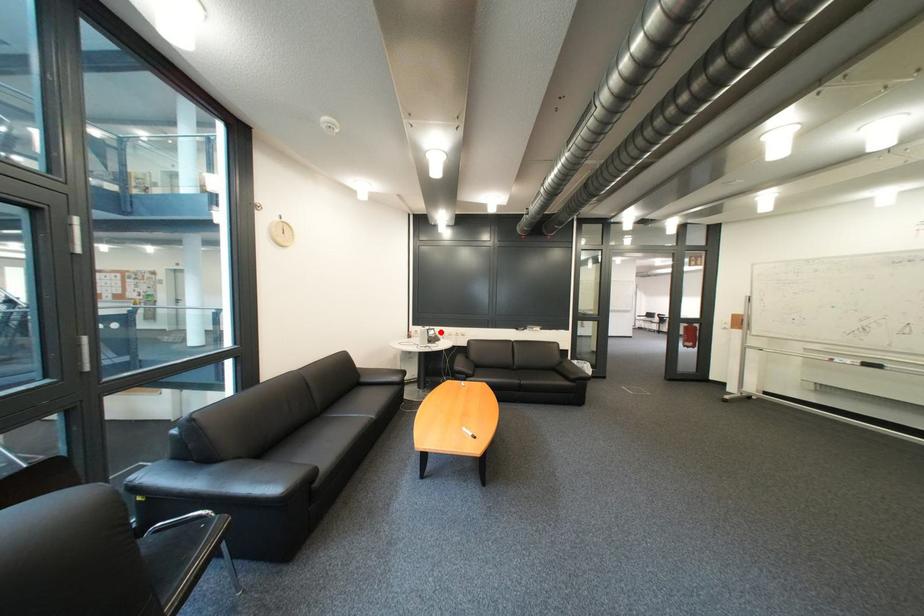
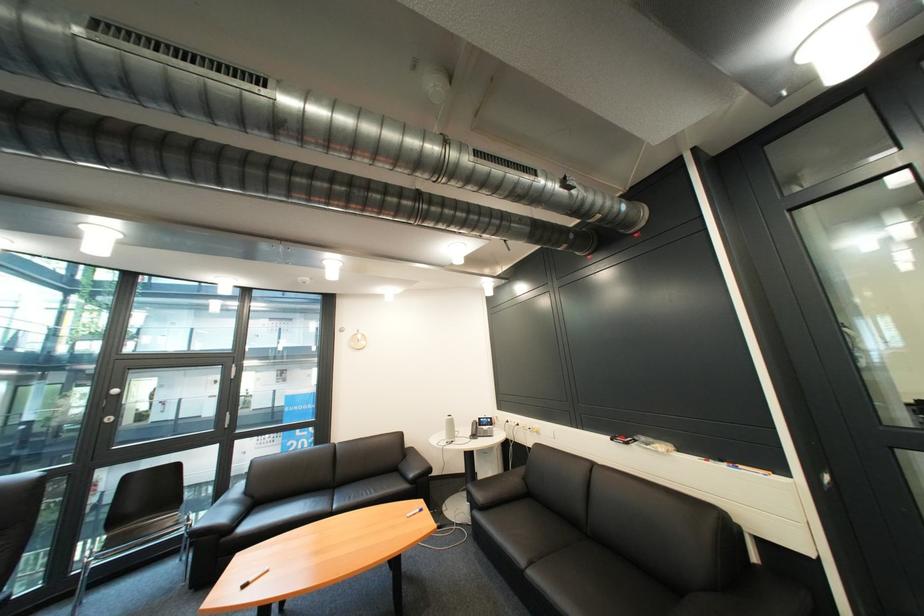
Where in the second image is the point corresponding to the highlighted location from the first image?

(492, 419)